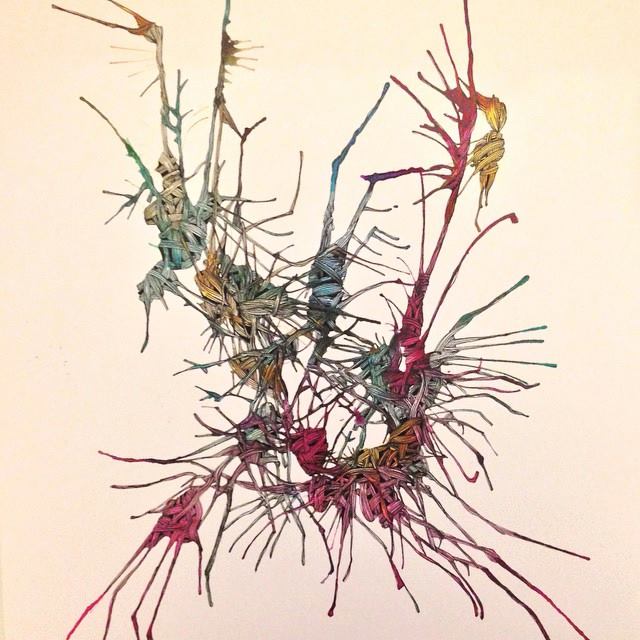
Where is `plant leaves`? The height and width of the screenshot is (640, 640). plant leaves is located at coordinates (321, 531), (299, 528), (281, 524), (220, 518), (196, 543), (178, 544), (166, 547), (152, 547), (137, 546).